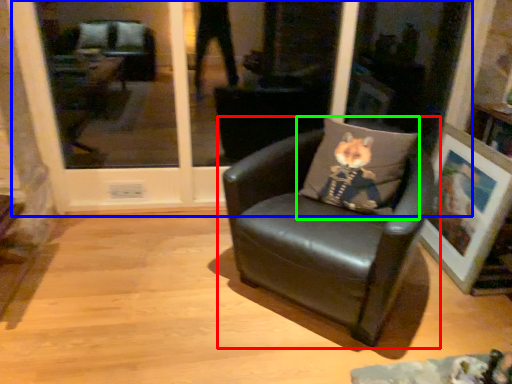
Question: Which is farther away from chair (highlighted by a red box)? glass door (highlighted by a blue box) or pillow (highlighted by a green box)?

Choices:
 (A) glass door
 (B) pillow

Answer: (A)